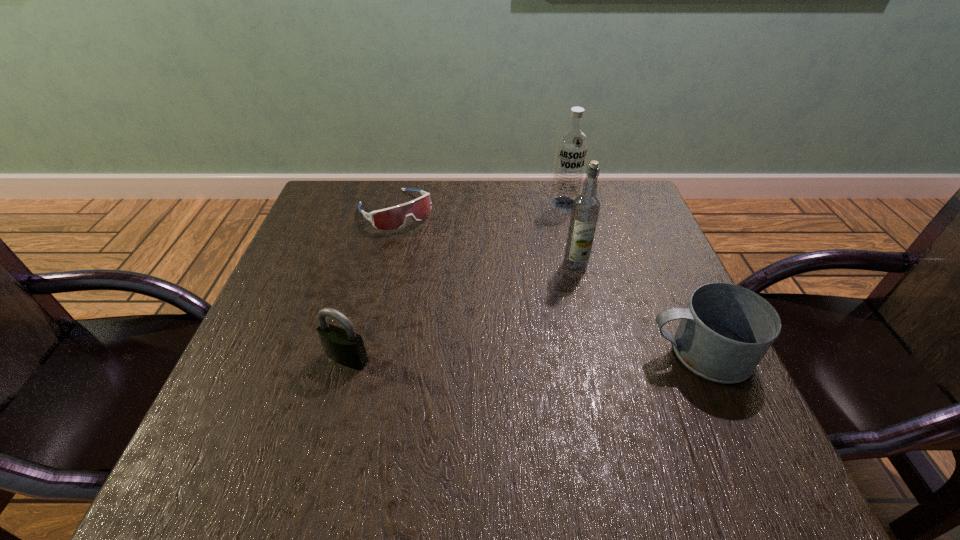
Find the location of a particular element. This screenshot has width=960, height=540. free space on the desktop that is between the padlock and the rightmost object and is positioned on the front-facing side of the shortest object is located at coordinates (525, 355).

Identify the location of vacant space on the desktop that is between the padlock and the rightmost object and is positioned on the front label of the farther vodka. (528, 355).

Find the location of `vacant space on the desktop that is between the padlock and the mug and is positioned on the label of the third farthest object`. vacant space on the desktop that is between the padlock and the mug and is positioned on the label of the third farthest object is located at coordinates (497, 356).